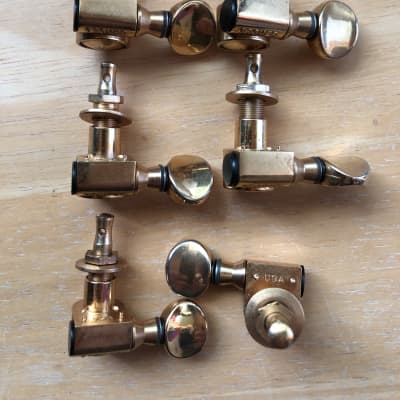
Where is `washer`? washer is located at coordinates (92, 265), (261, 91), (100, 110), (290, 146).